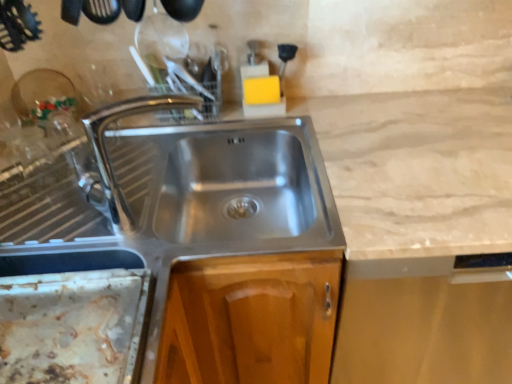
Locate an element on the screen. free space above rusty metal tray at lower left (from a real-world perspective) is located at coordinates (58, 333).